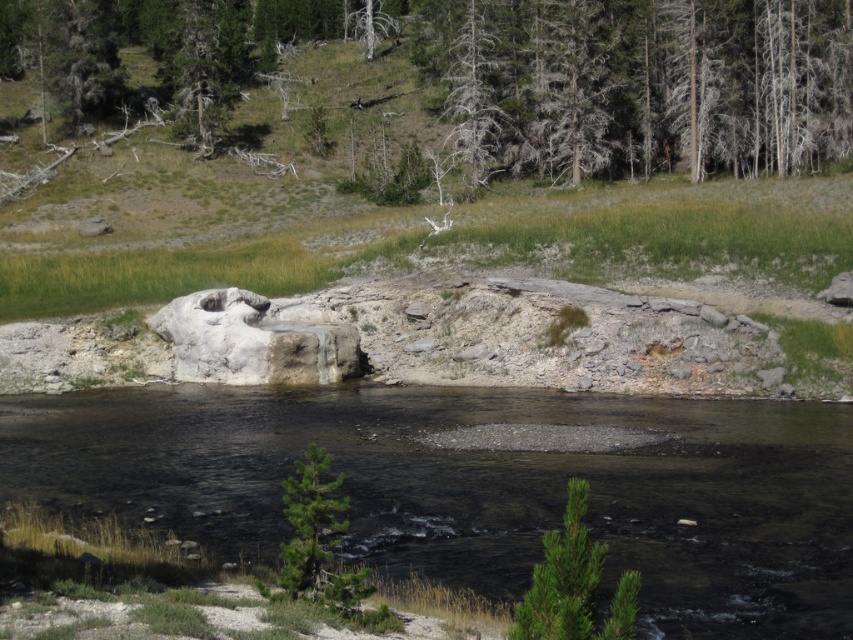
You are standing at the point closer to the camera in the image. Which point are you at, point (289, 588) or point (476, 61)?

You are at point (289, 588) because it is closer to the camera than point (476, 61).

You are planning to cross the river using a small boat. The boat can only carry items that are smaller than the clear water at center. Can you safely carry the gray textured tree at upper center with you?

The clear water at center has a larger size compared to the gray textured tree at upper center, so yes, you can safely carry the gray textured tree at upper center because it is smaller than the clear water at center.